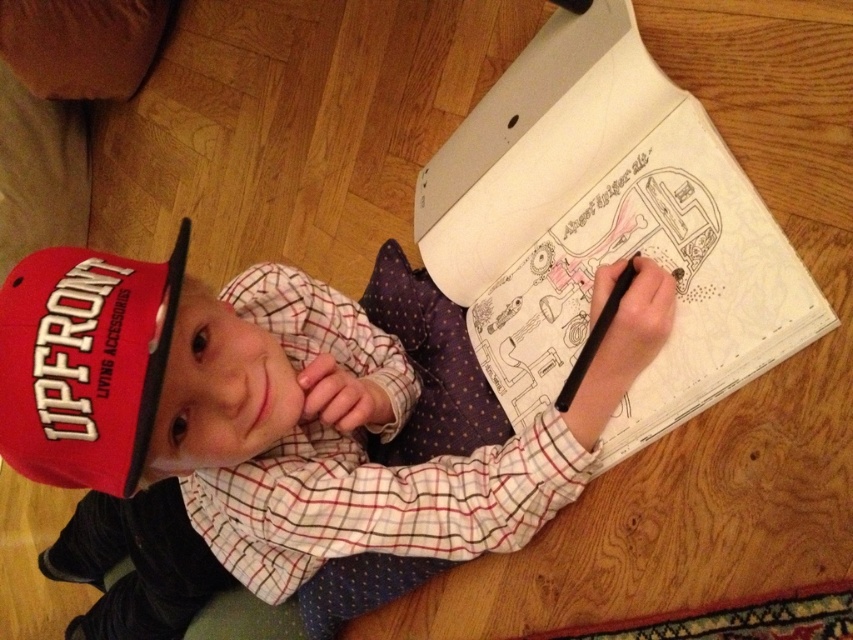
You are holding a camera and want to take a photo of the point at coordinates point (149, 321). The camera is currently 55.55 centimeters away from the point. If the camera requires a minimum distance of 60 centimeters to focus properly, will you need to move closer or farther away to get a clear photo?

The camera is currently 55.55 centimeters away from the point, which is less than the required 60 centimeters. To get a clear photo, you need to move farther away from the point to increase the distance to at least 60 centimeters.

You are observing a child drawing in a sketchbook. The child has two points marked on the paper at coordinates point [93,406] and point [521,278]. If you were to look at the sketchbook from above, which point would appear closer to you?

Point [93,406] is closer to the viewer than point [521,278], so it would appear closer when viewed from above.

You are a teacher observing a student who is drawing in their sketchbook. The student is wearing a matte red cap at upper left and has a white paper at center. Which object is located to the right of the other?

The white paper at center is positioned on the right side of matte red cap at upper left.